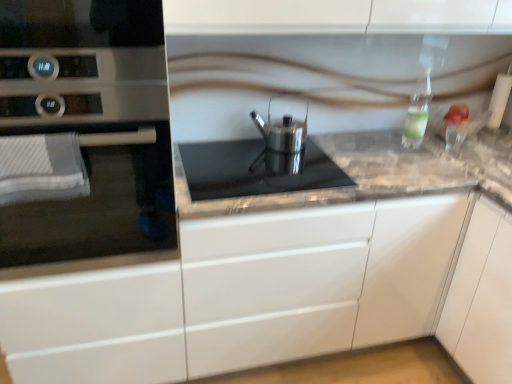
The image size is (512, 384). I want to click on vacant area that is in front of satin silver kettle at center, so click(x=294, y=167).